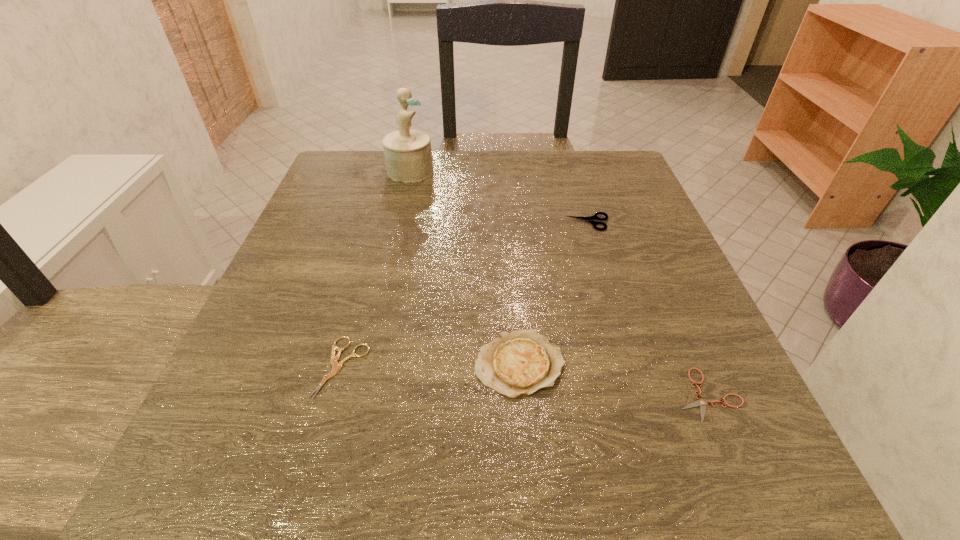
The height and width of the screenshot is (540, 960). Find the location of `free point between the fourth shortest object and the figurine`. free point between the fourth shortest object and the figurine is located at coordinates (465, 267).

What are the coordinates of `vacant area that lies between the tallest shears and the second tallest object` in the screenshot? It's located at (554, 293).

Locate an element on the screen. The width and height of the screenshot is (960, 540). free space between the second farthest object and the third object from right to left is located at coordinates (554, 293).

You are a GUI agent. You are given a task and a screenshot of the screen. Output one action in this format:
    pyautogui.click(x=<x>, y=<y>)
    Task: Click on the free space between the fourth tallest object and the quiche
    
    Given the screenshot: What is the action you would take?
    pyautogui.click(x=431, y=366)

The image size is (960, 540). I want to click on unoccupied position between the third tallest object and the shortest shears, so click(x=648, y=309).

Identify the location of the fourth closest object to the second tallest shears. (408, 156).

Identify which object is the second closest to the figurine. Please provide its 2D coordinates. Your answer should be formatted as a tuple, i.e. [(x, y)], where the tuple contains the x and y coordinates of a point satisfying the conditions above.

[(336, 366)]

Find the location of a particular element. the second closest shears to the tallest object is located at coordinates (336, 366).

Identify which shears is the second nearest to the tallest object. Please provide its 2D coordinates. Your answer should be formatted as a tuple, i.e. [(x, y)], where the tuple contains the x and y coordinates of a point satisfying the conditions above.

[(336, 366)]

Locate an element on the screen. The image size is (960, 540). vacant space that satisfies the following two spatial constraints: 1. at the beak of the farthest object; 2. on the right side of the shortest object is located at coordinates (359, 395).